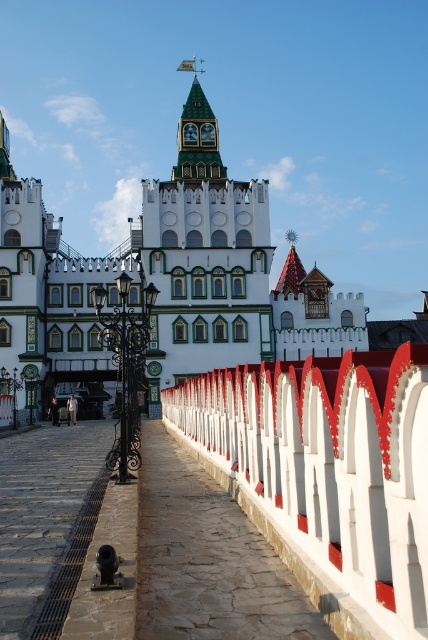
You are an architect designing a new garden layout and need to place a statue between the white painted wood fence at center and the green stone clock tower at upper center. Which object should the statue be closer to if it must be placed closer to the smaller one?

The green stone clock tower at upper center is smaller in size than the white painted wood fence at center, so the statue should be placed closer to the green stone clock tower at upper center.

You are a visitor standing at the entrance of the building and want to reach the green stone clock tower at upper center. According to the scene, which direction should you move relative to the stone paved path at center?

The stone paved path at center is located below the green stone clock tower at upper center, so you should move upward along the stone paved path at center to reach the green stone clock tower at upper center.

You are standing at the entrance of the grand building and see two points marked in the scene. The first point is at coordinate point (362, 454) and the second is at point (195, 150). Which point is closer to you?

Point (362, 454) is in front of point (195, 150), so the first point is closer to you.